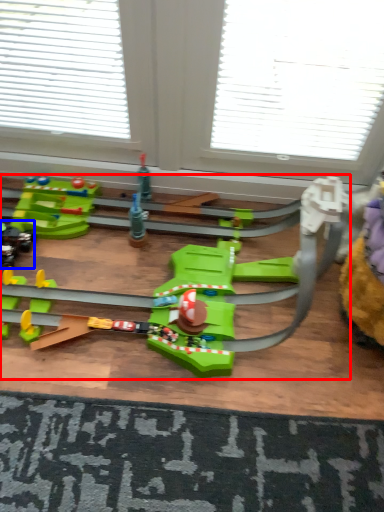
Question: Which point is closer to the camera, toy (highlighted by a red box) or toy (highlighted by a blue box)?

Choices:
 (A) toy
 (B) toy

Answer: (A)